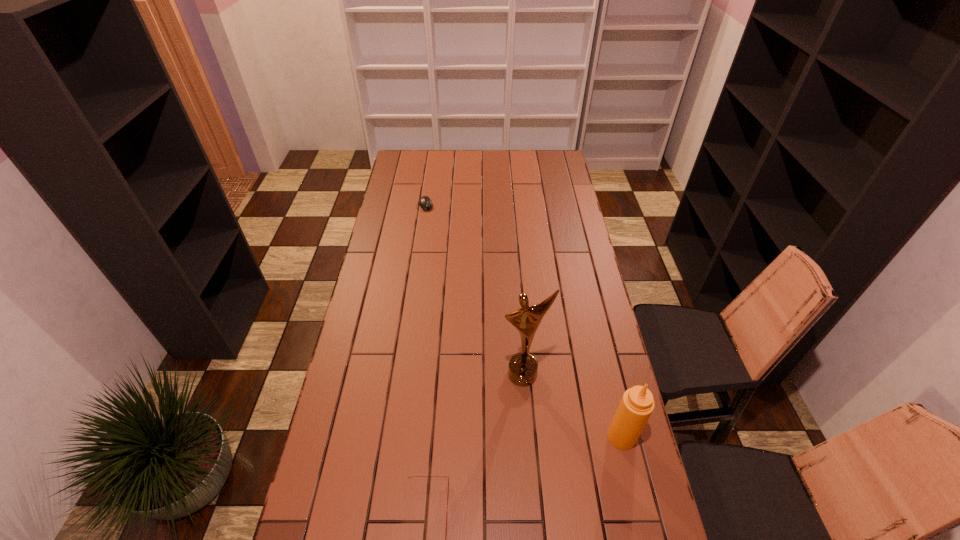
Find the location of a particular element. The width and height of the screenshot is (960, 540). free region located on the wheel side of the shortest object is located at coordinates (441, 243).

This screenshot has width=960, height=540. Find the location of `free space located 0.330m on the wheel side of the shortest object`. free space located 0.330m on the wheel side of the shortest object is located at coordinates (445, 256).

You are a GUI agent. You are given a task and a screenshot of the screen. Output one action in this format:
    pyautogui.click(x=<x>, y=<y>)
    Task: Click on the vacant space located 0.210m on the wheel side of the shortest object
    This screenshot has width=960, height=540.
    Given the screenshot: What is the action you would take?
    pyautogui.click(x=439, y=239)

Where is `object present at the left edge`? The image size is (960, 540). object present at the left edge is located at coordinates (425, 202).

You are a GUI agent. You are given a task and a screenshot of the screen. Output one action in this format:
    pyautogui.click(x=<x>, y=<y>)
    Task: Click on the object present at the right edge
    
    Given the screenshot: What is the action you would take?
    coord(637,404)

You are a GUI agent. You are given a task and a screenshot of the screen. Output one action in this format:
    pyautogui.click(x=<x>, y=<y>)
    Task: Click on the free space at the far edge of the desktop
    The width and height of the screenshot is (960, 540).
    Given the screenshot: What is the action you would take?
    pyautogui.click(x=467, y=158)

The width and height of the screenshot is (960, 540). In the image, there is a desktop. Identify the location of vacant space at the near edge. (447, 534).

At what (x,y) coordinates should I click in order to perform the action: click on free point at the left edge. Please return your answer as a coordinate pair (x, y). Looking at the image, I should click on (405, 183).

At what (x,y) coordinates should I click in order to perform the action: click on vacant space at the right edge. Please return your answer as a coordinate pair (x, y). Image resolution: width=960 pixels, height=540 pixels. Looking at the image, I should click on (577, 379).

Locate an element on the screen. The image size is (960, 540). vacant area at the near left corner of the desktop is located at coordinates (354, 514).